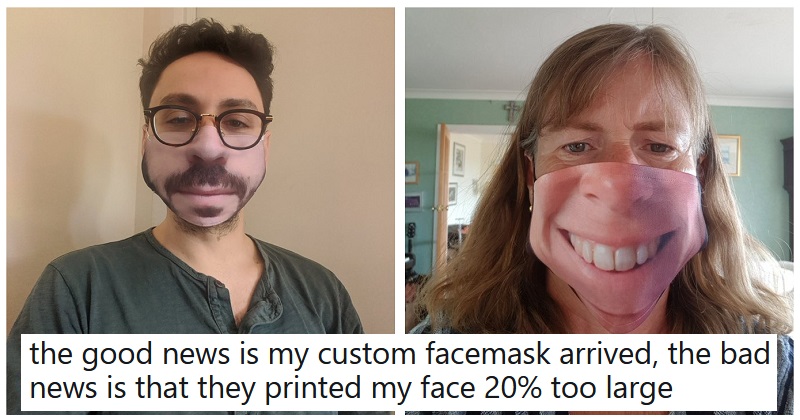
Locate an element on the screen. This screenshot has width=800, height=420. wall is located at coordinates (350, 169), (101, 171), (412, 129).